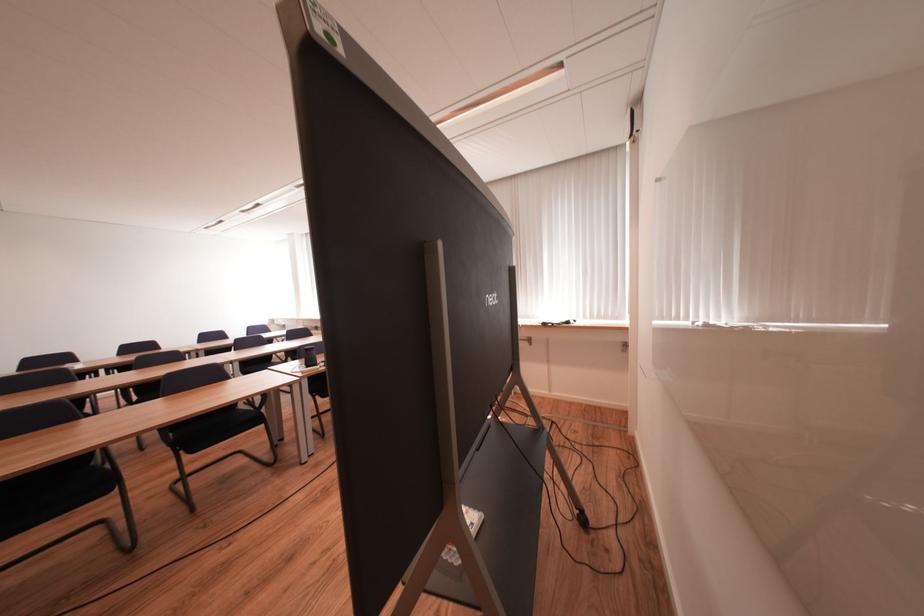
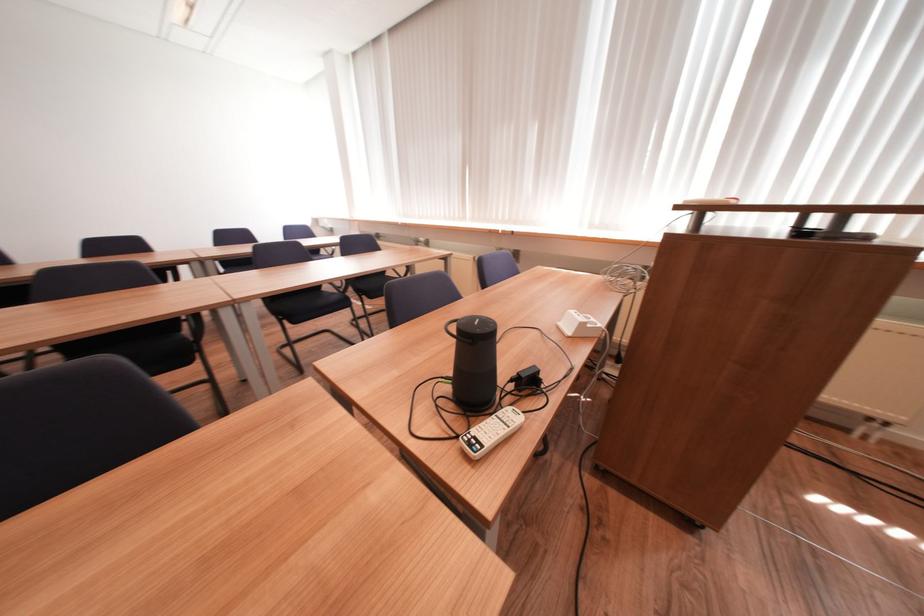
Which direction would the cameraman need to move to produce the second image?

The cameraman moved toward left, forward.